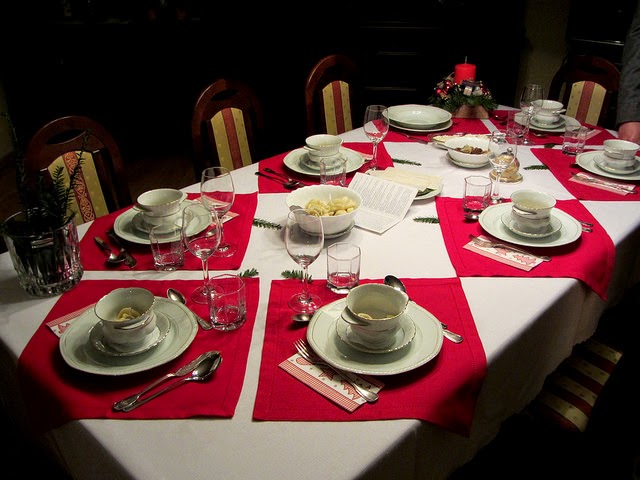
At what (x,y) coordinates should I click in order to perform the action: click on goblets. Please return your answer as a coordinate pair (x, y). Looking at the image, I should click on (218, 192), (203, 228), (308, 238), (374, 126), (531, 99), (504, 151).